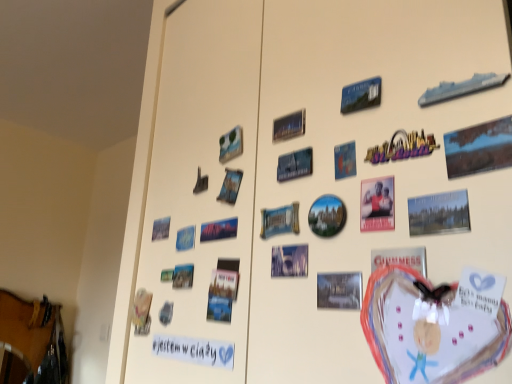
Question: Looking at the image, does blue plastic postcard at upper right, the 9th postcard in the left-to-right sequence, seem bigger or smaller compared to matte paper postcard at upper right, arranged as the 12th postcard when viewed from the left?

Choices:
 (A) big
 (B) small

Answer: (B)

Question: In the image, is blue plastic postcard at upper right, the 9th postcard in the left-to-right sequence, on the left side or the right side of matte paper postcard at upper right, which is the second postcard from right to left?

Choices:
 (A) right
 (B) left

Answer: (B)

Question: Estimate the real-world distances between objects in this image. Which object is closer to the blue paper postcard at center-left, the 1th postcard when ordered from left to right?

Choices:
 (A) blue plastic postcard at upper right, which is the fifth postcard from right to left
 (B) matte plastic poster at center right, placed as the 10th postcard when sorted from left to right
 (C) metallic silver postcard at center right, the 3th postcard positioned from the right
 (D) metallic rectangular poster at center
 (E) blue glossy postcard at upper center, the 6th postcard viewed from the right

Answer: (D)

Question: Estimate the real-world distances between objects in this image. Which object is farther from the metallic silver postcard at center, the ninth postcard when ordered from right to left?

Choices:
 (A) blue plastic postcard at upper right, the 9th postcard in the left-to-right sequence
 (B) matte paper postcard at upper right, arranged as the 12th postcard when viewed from the left
 (C) white paper at lower left
 (D) blue paper postcard at center-left, the 1th postcard when ordered from left to right
 (E) metallic silver postcard at center, which is the 7th postcard in left-to-right order

Answer: (D)